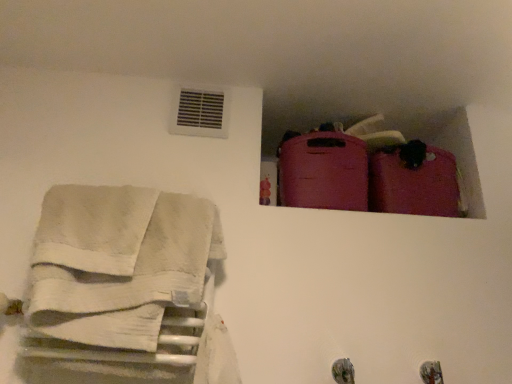
Question: Would you say matte pink suitcase at upper right, marked as the 1th luggage in a right-to-left arrangement, contains matte pink suitcase at upper right, which is the second luggage in right-to-left order?

Choices:
 (A) yes
 (B) no

Answer: (B)

Question: Does matte pink suitcase at upper right, the second luggage in the left-to-right sequence, have a greater height compared to matte pink suitcase at upper right, the 1th luggage in the left-to-right sequence?

Choices:
 (A) no
 (B) yes

Answer: (A)

Question: Does matte pink suitcase at upper right, the second luggage in the left-to-right sequence, have a smaller size compared to matte pink suitcase at upper right, the 1th luggage in the left-to-right sequence?

Choices:
 (A) yes
 (B) no

Answer: (A)

Question: Does matte pink suitcase at upper right, marked as the 1th luggage in a right-to-left arrangement, appear on the right side of matte pink suitcase at upper right, the 1th luggage in the left-to-right sequence?

Choices:
 (A) yes
 (B) no

Answer: (A)

Question: From a real-world perspective, is matte pink suitcase at upper right, the second luggage in the left-to-right sequence, below matte pink suitcase at upper right, the 1th luggage in the left-to-right sequence?

Choices:
 (A) yes
 (B) no

Answer: (B)

Question: In the image, is white cotton towels at left on the left side or the right side of matte pink suitcase at upper right, the second luggage in the left-to-right sequence?

Choices:
 (A) left
 (B) right

Answer: (A)

Question: Considering the positions of white cotton towels at left and matte pink suitcase at upper right, marked as the 1th luggage in a right-to-left arrangement, in the image, is white cotton towels at left taller or shorter than matte pink suitcase at upper right, marked as the 1th luggage in a right-to-left arrangement,?

Choices:
 (A) tall
 (B) short

Answer: (A)

Question: From the image's perspective, is white cotton towels at left positioned above or below matte pink suitcase at upper right, the second luggage in the left-to-right sequence?

Choices:
 (A) below
 (B) above

Answer: (A)

Question: In the image, is white cotton towels at left positioned in front of or behind matte pink suitcase at upper right, marked as the 1th luggage in a right-to-left arrangement?

Choices:
 (A) front
 (B) behind

Answer: (A)

Question: Does point (407, 157) appear closer or farther from the camera than point (365, 165)?

Choices:
 (A) farther
 (B) closer

Answer: (A)

Question: Based on their positions, is matte pink suitcase at upper right, the second luggage in the left-to-right sequence, located to the left or right of matte pink suitcase at upper right, the 1th luggage in the left-to-right sequence?

Choices:
 (A) right
 (B) left

Answer: (A)

Question: Is matte pink suitcase at upper right, marked as the 1th luggage in a right-to-left arrangement, wider or thinner than matte pink suitcase at upper right, the 1th luggage in the left-to-right sequence?

Choices:
 (A) thin
 (B) wide

Answer: (A)

Question: In the image, is matte pink suitcase at upper right, marked as the 1th luggage in a right-to-left arrangement, positioned in front of or behind matte pink suitcase at upper right, which is the second luggage in right-to-left order?

Choices:
 (A) behind
 (B) front

Answer: (A)

Question: Is point (316, 178) closer or farther from the camera than point (397, 175)?

Choices:
 (A) closer
 (B) farther

Answer: (A)

Question: From the image's perspective, is matte pink suitcase at upper right, which is the second luggage in right-to-left order, located above or below matte pink suitcase at upper right, marked as the 1th luggage in a right-to-left arrangement?

Choices:
 (A) below
 (B) above

Answer: (B)